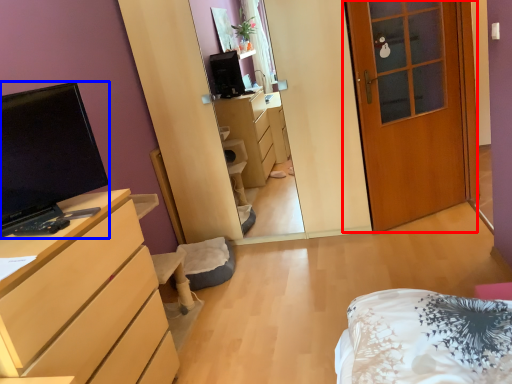
Question: Which object is closer to the camera taking this photo, door (highlighted by a red box) or television (highlighted by a blue box)?

Choices:
 (A) door
 (B) television

Answer: (B)